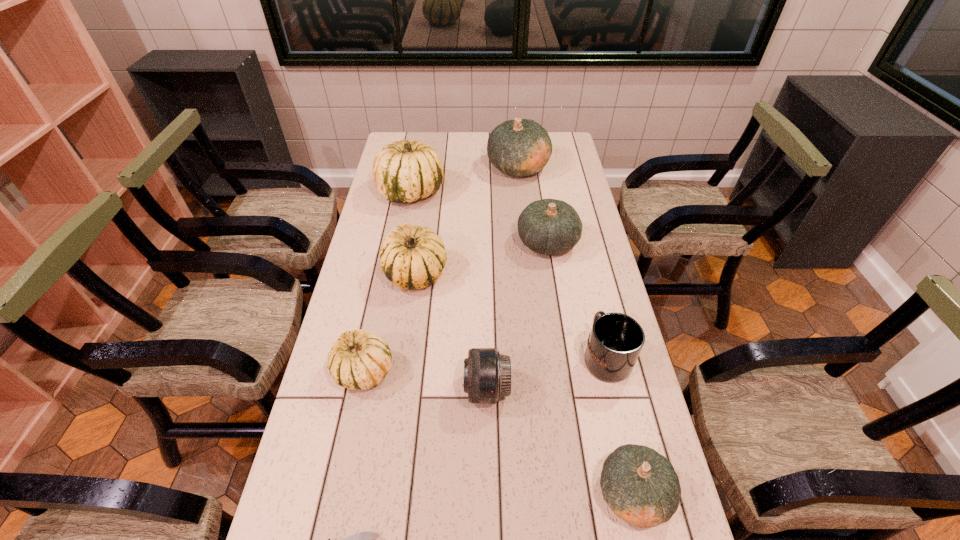
Identify the location of blank space located on the front of the biggest orange gourd. The width and height of the screenshot is (960, 540). (522, 202).

This screenshot has width=960, height=540. Find the location of `vacant space situated on the back of the farthest white gourd`. vacant space situated on the back of the farthest white gourd is located at coordinates (420, 139).

Identify the location of free space located 0.330m on the front of the second farthest orange gourd. (564, 348).

Find the location of `blank area located on the back of the second nearest white gourd`. blank area located on the back of the second nearest white gourd is located at coordinates (425, 208).

Image resolution: width=960 pixels, height=540 pixels. What are the coordinates of `vacant space situated 0.120m with the handle on the side of the black mug` in the screenshot? It's located at (592, 300).

The image size is (960, 540). Identify the location of blank space located 0.230m with the handle on the side of the black mug. (587, 274).

Locate an element on the screen. vacant space located with the handle on the side of the black mug is located at coordinates (578, 239).

The height and width of the screenshot is (540, 960). Identify the location of free space located on the front-facing side of the telephoto lens. (429, 389).

Locate an element on the screen. This screenshot has width=960, height=540. free space located on the front-facing side of the telephoto lens is located at coordinates (367, 389).

Find the location of a particular element. The height and width of the screenshot is (540, 960). vacant region located on the front-facing side of the telephoto lens is located at coordinates (391, 389).